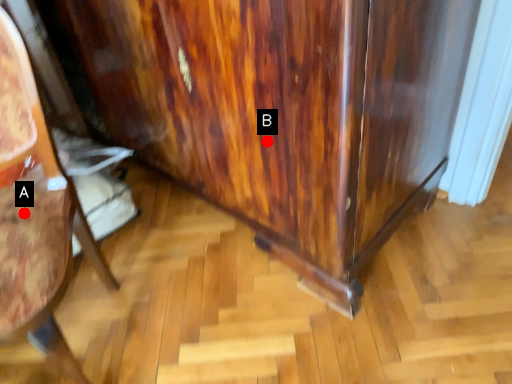
Question: Two points are circled on the image, labeled by A and B beside each circle. Which point is closer to the camera taking this photo?

Choices:
 (A) A is closer
 (B) B is closer

Answer: (A)